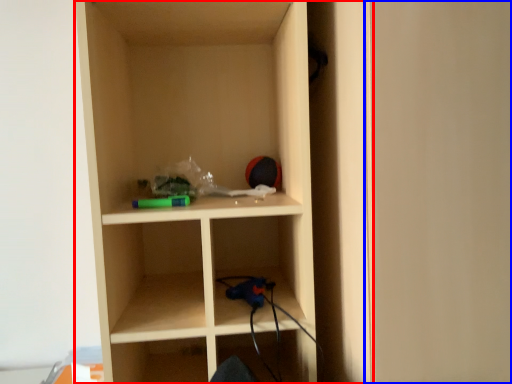
Question: Which point is closer to the camera, shelf (highlighted by a red box) or door (highlighted by a blue box)?

Choices:
 (A) shelf
 (B) door

Answer: (B)